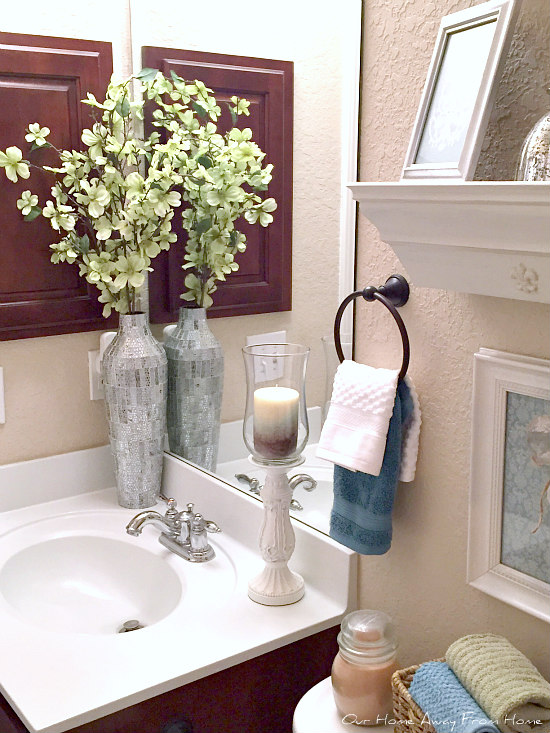
This screenshot has height=733, width=550. Identify the location of light switch. (274, 358), (262, 360).